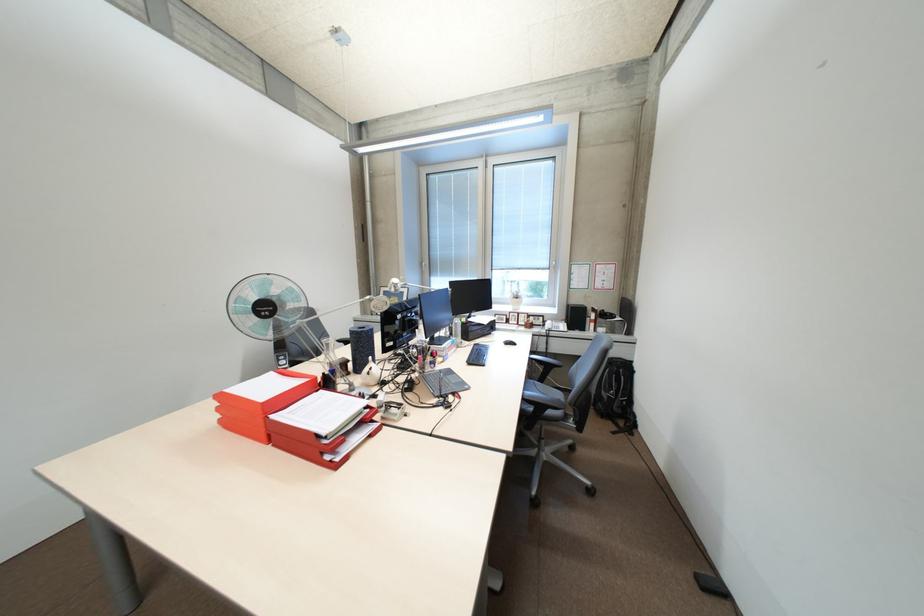
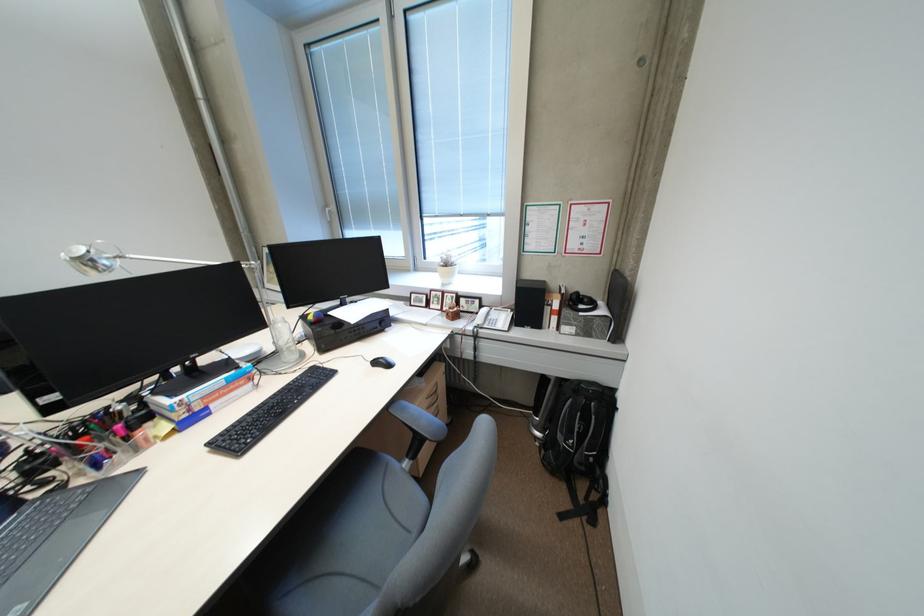
Locate, in the second image, the point that corresponds to [517,321] in the first image.

(438, 304)